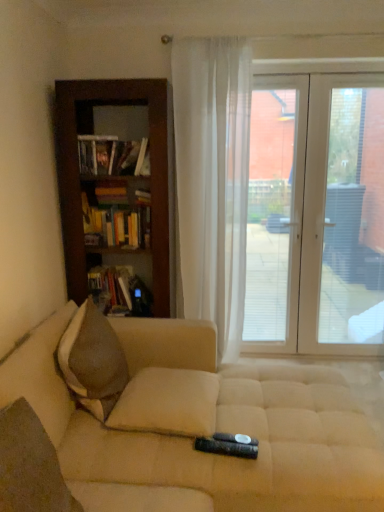
Where is `wooden bookcase at left`? The width and height of the screenshot is (384, 512). wooden bookcase at left is located at coordinates (79, 181).

What do you see at coordinates (79, 181) in the screenshot? This screenshot has height=512, width=384. I see `wooden bookcase at left` at bounding box center [79, 181].

The image size is (384, 512). What do you see at coordinates (168, 403) in the screenshot?
I see `beige fabric pillow at lower center, the 2th pillow in the left-to-right sequence` at bounding box center [168, 403].

Measure the distance between white sheer curtain at center and camera.

They are 2.50 meters apart.

This screenshot has width=384, height=512. What do you see at coordinates (213, 180) in the screenshot?
I see `white sheer curtain at center` at bounding box center [213, 180].

You are a GUI agent. You are given a task and a screenshot of the screen. Output one action in this format:
    pyautogui.click(x=<x>, y=<y>)
    Task: Click on the white glass door at right
    This screenshot has width=384, height=512.
    Given the screenshot: What is the action you would take?
    pyautogui.click(x=316, y=216)

Find the location of a particular element. The image size is (384, 512). wooden bookcase at left is located at coordinates (79, 181).

In the image, is white glass door at right positioned in front of or behind hardcover book at center-left, the 1th book when ordered from bottom to top?

white glass door at right is positioned farther from the viewer than hardcover book at center-left, the 1th book when ordered from bottom to top.

Is white glass door at right looking in the opposite direction of hardcover book at center-left, the 1th book when ordered from bottom to top?

No, white glass door at right is not facing away from hardcover book at center-left, the 1th book when ordered from bottom to top.

Considering the points (309, 268) and (117, 271), which point is in front, point (309, 268) or point (117, 271)?

The point (117, 271) is closer to the camera.

Can you confirm if white glass door at right is shorter than hardcover book at center-left, the 1th book when ordered from bottom to top?

Incorrect, the height of white glass door at right does not fall short of that of hardcover book at center-left, the 1th book when ordered from bottom to top.

Considering the positions of point (354, 175) and point (238, 167), is point (354, 175) closer or farther from the camera than point (238, 167)?

Point (354, 175).

From the image's perspective, is transparent glass door at right, which is the first window screen from right to left, located above white sheer curtain at center?

No, from the image's perspective, transparent glass door at right, which is the first window screen from right to left, is not on top of white sheer curtain at center.

There is a white sheer curtain at center. In order to click on the 1st window screen below it (from the image's perspective) in this screenshot , I will do `click(343, 217)`.

Can you confirm if transparent glass door at right, which is the first window screen from right to left, is thinner than white sheer curtain at center?

Indeed, transparent glass door at right, which is the first window screen from right to left, has a lesser width compared to white sheer curtain at center.

Which is further, (x=189, y=58) or (x=32, y=496)?

The point (x=189, y=58) is farther from the camera.

Does white sheer curtain at center have a lesser width compared to brown textured pillow at lower left, which appears as the first pillow when viewed from the front?

No.

Considering the relative positions of white sheer curtain at center and brown textured pillow at lower left, which is counted as the 1th pillow, starting from the left, in the image provided, is white sheer curtain at center to the left of brown textured pillow at lower left, which is counted as the 1th pillow, starting from the left, from the viewer's perspective?

Incorrect, white sheer curtain at center is not on the left side of brown textured pillow at lower left, which is counted as the 1th pillow, starting from the left.

Is white sheer curtain at center oriented towards brown textured pillow at lower left, arranged as the second pillow when viewed from the right?

No, white sheer curtain at center is not aimed at brown textured pillow at lower left, arranged as the second pillow when viewed from the right.

Considering the points (73, 281) and (88, 233), which point is behind, point (73, 281) or point (88, 233)?

The point (88, 233) is farther.

Can you tell me how much wooden bookcase at left and hardcover books at left, which is the 2th book from top to bottom, differ in facing direction?

The angle between the facing direction of wooden bookcase at left and the facing direction of hardcover books at left, which is the 2th book from top to bottom, is 1.69 degrees.

Looking at their sizes, would you say wooden bookcase at left is wider or thinner than hardcover books at left, which is the 2th book from top to bottom?

Clearly, wooden bookcase at left has more width compared to hardcover books at left, which is the 2th book from top to bottom.

Is wooden bookcase at left outside of hardcover books at left, which is counted as the second book, starting from the bottom?

Yes, wooden bookcase at left is located beyond the bounds of hardcover books at left, which is counted as the second book, starting from the bottom.

Is hardcover books at left, which is the 2th book from top to bottom, bigger or smaller than transparent glass door at right, the second window screen viewed from the left?

hardcover books at left, which is the 2th book from top to bottom, is smaller than transparent glass door at right, the second window screen viewed from the left.

How different are the orientations of hardcover books at left, which is counted as the second book, starting from the bottom, and transparent glass door at right, which is the first window screen from right to left, in degrees?

4.06 degrees separate the facing orientations of hardcover books at left, which is counted as the second book, starting from the bottom, and transparent glass door at right, which is the first window screen from right to left.

Considering the positions of point (146, 226) and point (367, 152), is point (146, 226) closer or farther from the camera than point (367, 152)?

Point (146, 226).

Looking at their sizes, would you say beige fabric pillow at lower center, the second pillow in the front-to-back sequence, is wider or thinner than brown textured pillow at lower left, which appears as the first pillow when viewed from the front?

beige fabric pillow at lower center, the second pillow in the front-to-back sequence, is wider than brown textured pillow at lower left, which appears as the first pillow when viewed from the front.

Considering the positions of objects beige fabric pillow at lower center, the 1th pillow positioned from the right, and brown textured pillow at lower left, which is the 2th pillow from back to front, in the image provided, who is in front, beige fabric pillow at lower center, the 1th pillow positioned from the right, or brown textured pillow at lower left, which is the 2th pillow from back to front,?

Positioned in front is brown textured pillow at lower left, which is the 2th pillow from back to front.

Considering the positions of objects beige fabric pillow at lower center, the second pillow in the front-to-back sequence, and brown textured pillow at lower left, arranged as the second pillow when viewed from the right, in the image provided, who is more to the right, beige fabric pillow at lower center, the second pillow in the front-to-back sequence, or brown textured pillow at lower left, arranged as the second pillow when viewed from the right,?

Positioned to the right is beige fabric pillow at lower center, the second pillow in the front-to-back sequence.

Identify the location of book that is the 1st object directly below the hardcover book at left, marked as the third book in a bottom-to-top arrangement (from a real-world perspective). This screenshot has width=384, height=512. (116, 224).

From a real-world perspective, is hardcover books at left, which is counted as the second book, starting from the bottom, positioned above or below hardcover book at left, which ranks as the first book in top-to-bottom order?

hardcover books at left, which is counted as the second book, starting from the bottom, is below hardcover book at left, which ranks as the first book in top-to-bottom order.

Which of these two, hardcover books at left, which is the 2th book from top to bottom, or hardcover book at left, which ranks as the first book in top-to-bottom order, is wider?

Wider between the two is hardcover book at left, which ranks as the first book in top-to-bottom order.

Can you tell me how much hardcover books at left, which is the 2th book from top to bottom, and hardcover book at left, which ranks as the first book in top-to-bottom order, differ in facing direction?

The facing directions of hardcover books at left, which is the 2th book from top to bottom, and hardcover book at left, which ranks as the first book in top-to-bottom order, are 0.00115 degrees apart.

This screenshot has width=384, height=512. In order to click on book that is the 2nd object to the left of the white glass door at right, starting at the anchor in this screenshot , I will do `click(111, 285)`.

From the white sheer curtain at center, count 2nd window screen to the right and point to it. Please provide its 2D coordinates.

[(343, 217)]

Estimate the real-world distances between objects in this image. Which object is further from white sheer curtain at center, transparent glass door at right, which is the first window screen from right to left, or hardcover books at left, which is the 2th book from top to bottom?

transparent glass door at right, which is the first window screen from right to left, lies further to white sheer curtain at center than the other object.

Considering their positions, is brown textured pillow at lower left, which is counted as the 1th pillow, starting from the left, positioned further to white sheer curtain at center than transparent plastic window screen at center, the second window screen from the right?

Among the two, brown textured pillow at lower left, which is counted as the 1th pillow, starting from the left, is located further to white sheer curtain at center.

Considering their positions, is white glass door at right positioned further to hardcover book at left, which ranks as the first book in top-to-bottom order, than hardcover books at left, which is the 2th book from top to bottom?

white glass door at right lies further to hardcover book at left, which ranks as the first book in top-to-bottom order, than the other object.

Consider the image. From the image, which object appears to be farther from brown textured pillow at left, wooden bookcase at left or hardcover book at center-left, the 1th book when ordered from bottom to top?

Based on the image, hardcover book at center-left, the 1th book when ordered from bottom to top, appears to be further to brown textured pillow at left.

Which object lies nearer to the anchor point brown textured pillow at left, transparent glass door at right, which is the first window screen from right to left, or wooden bookcase at left?

Among the two, wooden bookcase at left is located nearer to brown textured pillow at left.

Which object lies nearer to the anchor point hardcover book at left, which ranks as the first book in top-to-bottom order, hardcover book at center-left, which appears as the 3th book when viewed from the top, or wooden bookcase at left?

Based on the image, wooden bookcase at left appears to be nearer to hardcover book at left, which ranks as the first book in top-to-bottom order.

Looking at the image, which one is located closer to hardcover book at left, marked as the third book in a bottom-to-top arrangement, hardcover books at left, which is counted as the second book, starting from the bottom, or beige fabric pillow at lower center, arranged as the 1th pillow when viewed from the back?

Among the two, hardcover books at left, which is counted as the second book, starting from the bottom, is located nearer to hardcover book at left, marked as the third book in a bottom-to-top arrangement.

Considering their positions, is brown textured pillow at left positioned closer to wooden bookcase at left than beige fabric couch at lower center?

The object closer to wooden bookcase at left is brown textured pillow at left.

Find the location of `window screen located between white sheer curtain at center and transparent glass door at right, which is the first window screen from right to left, in the left-right direction`. window screen located between white sheer curtain at center and transparent glass door at right, which is the first window screen from right to left, in the left-right direction is located at coordinates (274, 213).

The image size is (384, 512). What are the coordinates of `window screen between brown textured pillow at left and transparent glass door at right, which is the first window screen from right to left, from left to right` in the screenshot? It's located at (274, 213).

Find the location of a particular element. The width and height of the screenshot is (384, 512). bookcase positioned between beige fabric couch at lower center and transparent plastic window screen at center, the second window screen from the right, from near to far is located at coordinates [79, 181].

Where is `window screen between hardcover book at center-left, the 1th book when ordered from bottom to top, and transparent glass door at right, which is the first window screen from right to left`? The height and width of the screenshot is (512, 384). window screen between hardcover book at center-left, the 1th book when ordered from bottom to top, and transparent glass door at right, which is the first window screen from right to left is located at coordinates (274, 213).